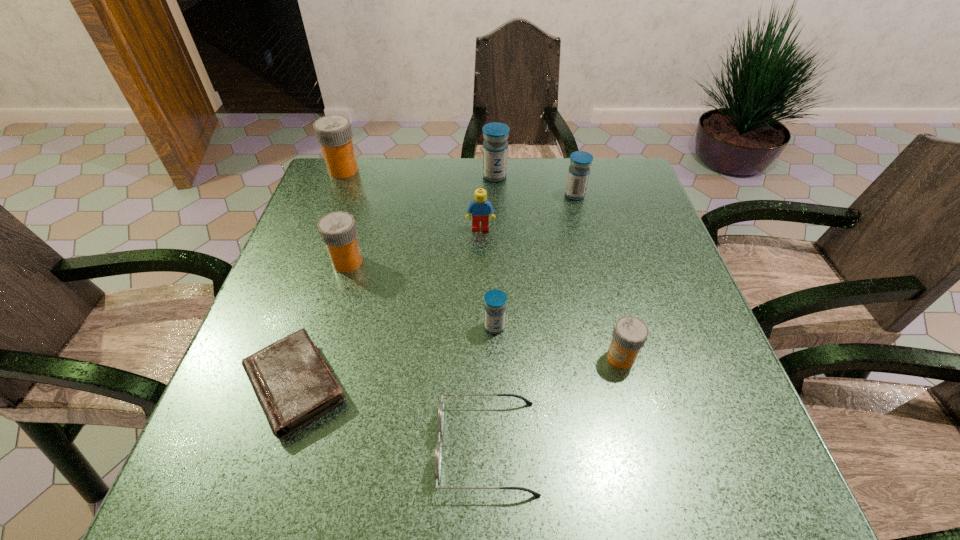
Identify which medicine is located as the third nearest to the diary. Please provide its 2D coordinates. Your answer should be formatted as a tuple, i.e. [(x, y)], where the tuple contains the x and y coordinates of a point satisfying the conditions above.

[(630, 333)]

Where is `orange medicine identified as the second closest to the third farthest object`? This screenshot has height=540, width=960. orange medicine identified as the second closest to the third farthest object is located at coordinates (338, 231).

Locate an element on the screen. This screenshot has height=540, width=960. the third closest orange medicine to the shortest object is located at coordinates (334, 133).

The height and width of the screenshot is (540, 960). What are the coordinates of `blue medicine object that ranks as the third closest to the second biggest orange medicine` in the screenshot? It's located at (578, 174).

Where is `blue medicine identified as the second closest to the sixth farthest object`? This screenshot has height=540, width=960. blue medicine identified as the second closest to the sixth farthest object is located at coordinates (495, 146).

Locate an element on the screen. free spot that satisfies the following two spatial constraints: 1. on the back side of the diary; 2. on the left side of the smallest blue medicine is located at coordinates (315, 327).

What are the coordinates of `free region that satisfies the following two spatial constraints: 1. on the label side of the second farthest orange medicine; 2. on the front side of the shortest object` in the screenshot? It's located at (310, 385).

Image resolution: width=960 pixels, height=540 pixels. I want to click on free point that satisfies the following two spatial constraints: 1. on the back side of the smallest blue medicine; 2. on the label side of the leftmost orange medicine, so click(490, 170).